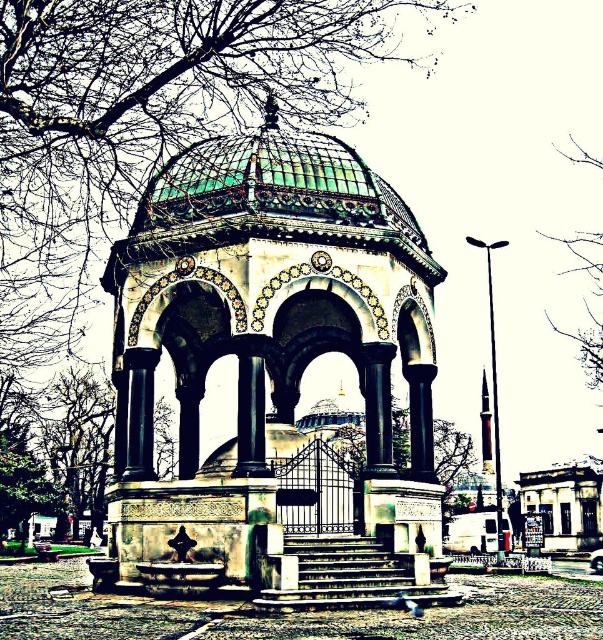
Based on the photo, you are standing in a park and want to take a photo of the white marble gazebo at center. If your camera can focus on objects up to 50 meters away, will you need to move closer to take a clear photo?

The white marble gazebo at center is 50.34 meters away from you. Since your camera can focus up to 50 meters, you need to move 0.34 meters closer to ensure the gazebo is within the camera range.

You are a tourist visiting the historical site and want to take a photo that includes both the white marble gazebo at center and the bare branches at upper right. Which object should you focus on first to ensure both are in frame?

You should focus on the white marble gazebo at center first because it is larger in size than the bare branches at upper right, so it will require more space in the frame.